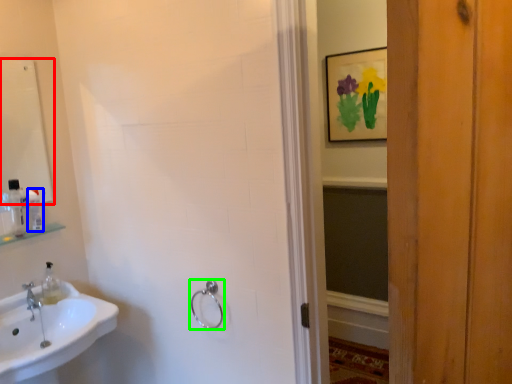
Question: Based on their relative distances, which object is farther from mirror (highlighted by a red box)? Choose from toiletry (highlighted by a blue box) and towel rack (highlighted by a green box).

Choices:
 (A) toiletry
 (B) towel rack

Answer: (B)